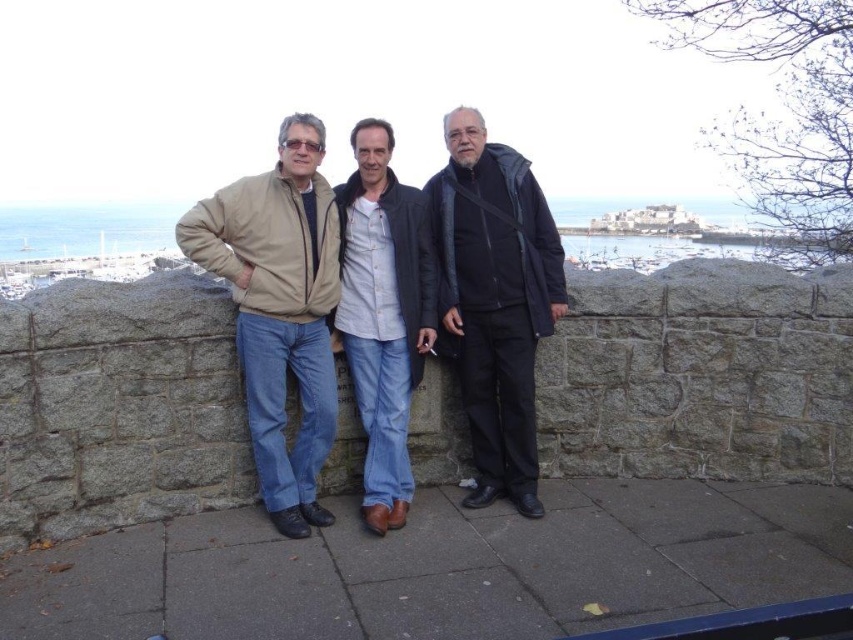
You are a tailor who needs to determine which jacket requires more fabric to make between the beige fabric jacket at left and the dark gray fabric jacket at center. Based on the image, which one would need more fabric?

The dark gray fabric jacket at center requires more fabric because it occupies more space than the beige fabric jacket at left.

Looking at this image, you are a photographer trying to capture a group photo of the three men. Since the beige fabric jacket at left and the dark gray fabric jacket at center are in the foreground, which jacket should you focus on to ensure it is in sharp focus if you want both jackets to be clear?

To ensure both the beige fabric jacket at left and the dark gray fabric jacket at center are in sharp focus, focus on the beige fabric jacket at left since it is closer to the viewer. This will ensure the closer jacket is in focus, and the farther dark gray fabric jacket at center will also be acceptably sharp within the depth of field.